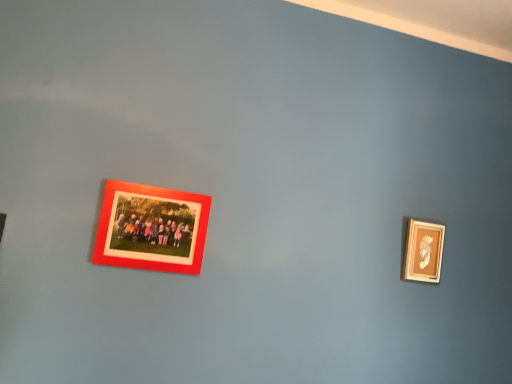
Question: Should I look upward or downward to see matte red photo frame at upper left, which is the 2th picture frame from right to left?

Choices:
 (A) up
 (B) down

Answer: (B)

Question: Can you confirm if matte red photo frame at upper left, which is the 2th picture frame from right to left, is bigger than wooden gold frame at right, the 2th picture frame when ordered from left to right?

Choices:
 (A) yes
 (B) no

Answer: (A)

Question: Is matte red photo frame at upper left, the second picture frame viewed from the back, outside of wooden gold frame at right, which ranks as the second picture frame in front-to-back order?

Choices:
 (A) yes
 (B) no

Answer: (A)

Question: Can you confirm if matte red photo frame at upper left, positioned as the 1th picture frame in front-to-back order, is positioned to the right of wooden gold frame at right, which appears as the first picture frame when viewed from the back?

Choices:
 (A) yes
 (B) no

Answer: (B)

Question: Considering the relative sizes of matte red photo frame at upper left, the second picture frame viewed from the back, and wooden gold frame at right, marked as the first picture frame in a right-to-left arrangement, in the image provided, is matte red photo frame at upper left, the second picture frame viewed from the back, shorter than wooden gold frame at right, marked as the first picture frame in a right-to-left arrangement,?

Choices:
 (A) no
 (B) yes

Answer: (A)

Question: Is wooden gold frame at right, which ranks as the second picture frame in front-to-back order, inside matte red photo frame at upper left, marked as the 1th picture frame in a left-to-right arrangement?

Choices:
 (A) no
 (B) yes

Answer: (A)

Question: Does matte red photo frame at upper left, positioned as the 1th picture frame in front-to-back order, lie behind wooden gold frame at right, marked as the first picture frame in a right-to-left arrangement?

Choices:
 (A) no
 (B) yes

Answer: (A)

Question: Would you say matte red photo frame at upper left, the second picture frame viewed from the back, is part of wooden gold frame at right, marked as the first picture frame in a right-to-left arrangement,'s contents?

Choices:
 (A) no
 (B) yes

Answer: (A)

Question: From a real-world perspective, is wooden gold frame at right, which appears as the first picture frame when viewed from the back, physically above matte red photo frame at upper left, marked as the 1th picture frame in a left-to-right arrangement?

Choices:
 (A) no
 (B) yes

Answer: (B)

Question: Considering the relative sizes of wooden gold frame at right, the 2th picture frame when ordered from left to right, and matte red photo frame at upper left, which is the 2th picture frame from right to left, in the image provided, is wooden gold frame at right, the 2th picture frame when ordered from left to right, wider than matte red photo frame at upper left, which is the 2th picture frame from right to left,?

Choices:
 (A) no
 (B) yes

Answer: (B)

Question: Is wooden gold frame at right, which appears as the first picture frame when viewed from the back, oriented towards matte red photo frame at upper left, positioned as the 1th picture frame in front-to-back order?

Choices:
 (A) yes
 (B) no

Answer: (B)

Question: Can you confirm if wooden gold frame at right, marked as the first picture frame in a right-to-left arrangement, is positioned to the right of matte red photo frame at upper left, which is the 2th picture frame from right to left?

Choices:
 (A) yes
 (B) no

Answer: (A)

Question: Can you confirm if wooden gold frame at right, marked as the first picture frame in a right-to-left arrangement, is positioned to the left of matte red photo frame at upper left, which is the 2th picture frame from right to left?

Choices:
 (A) no
 (B) yes

Answer: (A)

Question: Is matte red photo frame at upper left, the second picture frame viewed from the back, in front of or behind wooden gold frame at right, which ranks as the second picture frame in front-to-back order, in the image?

Choices:
 (A) behind
 (B) front

Answer: (B)